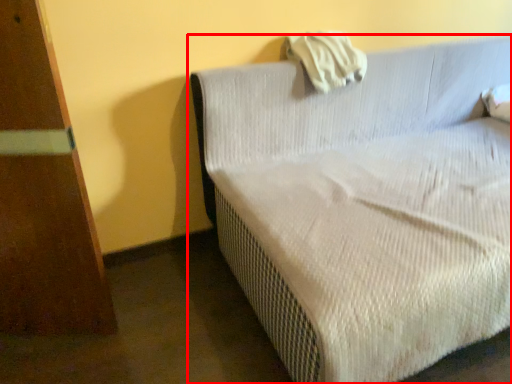
Question: From the image's perspective, where is studio couch (annotated by the red box) located relative to pillow?

Choices:
 (A) below
 (B) above

Answer: (A)